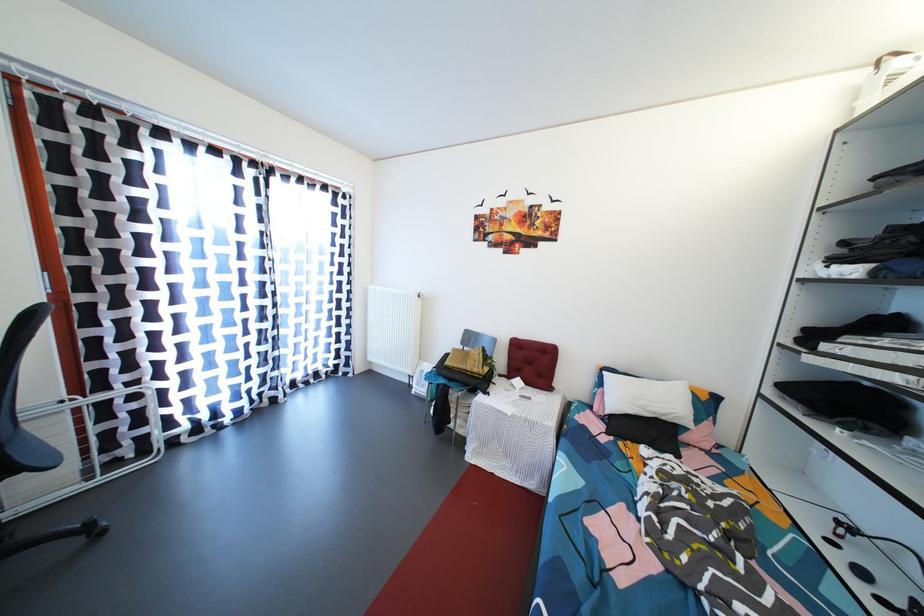
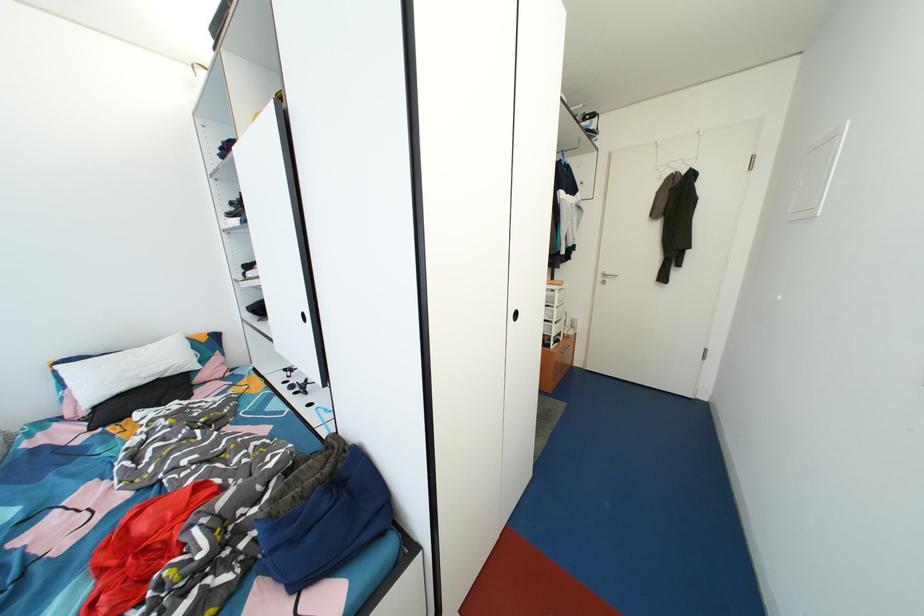
The first image is from the beginning of the video and the second image is from the end. How did the camera likely rotate when shooting the video?

The camera's rotation is toward right-down.